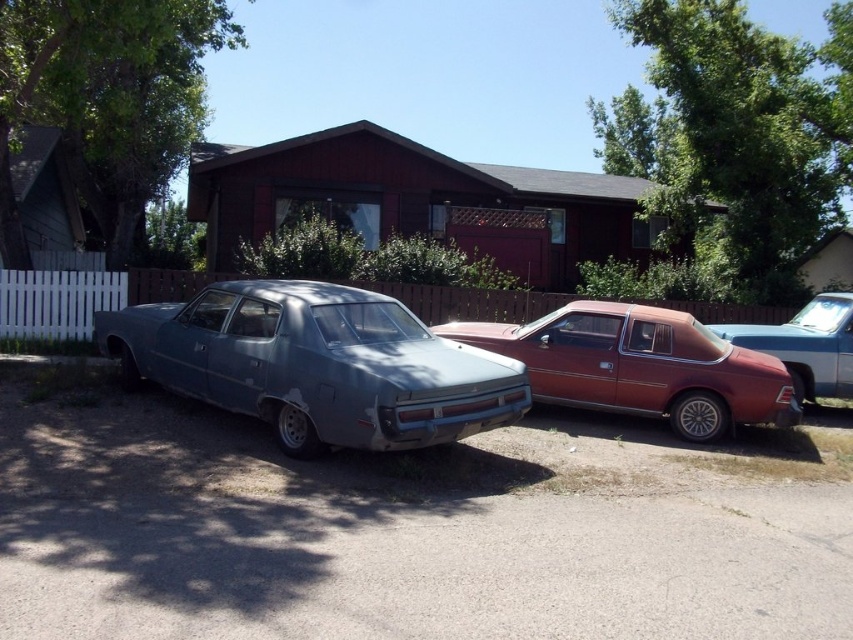
Image resolution: width=853 pixels, height=640 pixels. Describe the element at coordinates (405, 529) in the screenshot. I see `smooth asphalt driveway at lower center` at that location.

Does smooth asphalt driveway at lower center have a greater height compared to matte red car at center?

In fact, smooth asphalt driveway at lower center may be shorter than matte red car at center.

Describe the element at coordinates (405, 529) in the screenshot. I see `smooth asphalt driveway at lower center` at that location.

Locate an element on the screen. The image size is (853, 640). smooth asphalt driveway at lower center is located at coordinates (405, 529).

Image resolution: width=853 pixels, height=640 pixels. What are the coordinates of `matte blue sedan at center` in the screenshot? It's located at (316, 364).

Who is positioned more to the left, matte blue sedan at center or matte red car at center?

matte blue sedan at center

Is point (387, 410) in front of point (764, 419)?

Yes, point (387, 410) is in front of point (764, 419).

Identify the location of matte blue sedan at center. The image size is (853, 640). (316, 364).

Does matte blue sedan at center appear over metallic red car at right?

Yes, matte blue sedan at center is above metallic red car at right.

Is point (492, 372) less distant than point (811, 376)?

That is True.

Who is more distant from viewer, (418, 420) or (836, 301)?

The point (836, 301) is behind.

Locate an element on the screen. This screenshot has width=853, height=640. matte blue sedan at center is located at coordinates (316, 364).